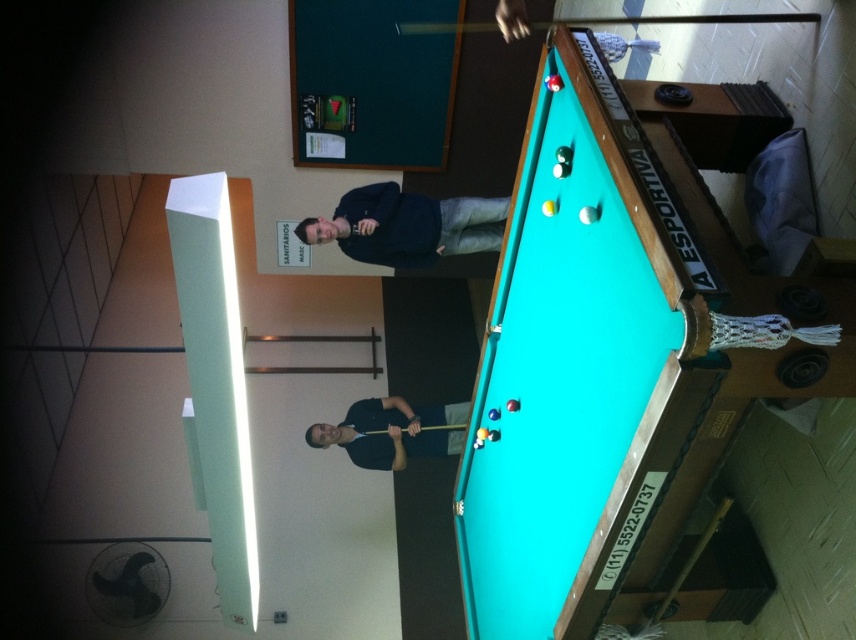
Can you confirm if teal felt pool table at upper right is positioned above dark blue shirt at center?

Yes, teal felt pool table at upper right is above dark blue shirt at center.

Is point (483, 524) more distant than point (438, 424)?

No, (483, 524) is closer to viewer.

Is point (495, 625) less distant than point (444, 429)?

Yes.

This screenshot has height=640, width=856. What are the coordinates of `teal felt pool table at upper right` in the screenshot? It's located at (607, 360).

Does dark blue sweater at upper center have a smaller size compared to wooden at center?

No.

Can you confirm if dark blue sweater at upper center is thinner than wooden at center?

Incorrect, dark blue sweater at upper center's width is not less than wooden at center's.

Where is `dark blue sweater at upper center`? The height and width of the screenshot is (640, 856). dark blue sweater at upper center is located at coordinates (407, 225).

Is dark blue sweater at upper center taller than yellow wood cue at upper center?

No.

Does dark blue sweater at upper center appear on the left side of yellow wood cue at upper center?

Correct, you'll find dark blue sweater at upper center to the left of yellow wood cue at upper center.

Between point (443, 227) and point (437, 29), which one is positioned in front?

Positioned in front is point (443, 227).

You are a GUI agent. You are given a task and a screenshot of the screen. Output one action in this format:
    pyautogui.click(x=<x>, y=<y>)
    Task: Click on the dark blue sweater at upper center
    
    Given the screenshot: What is the action you would take?
    pyautogui.click(x=407, y=225)